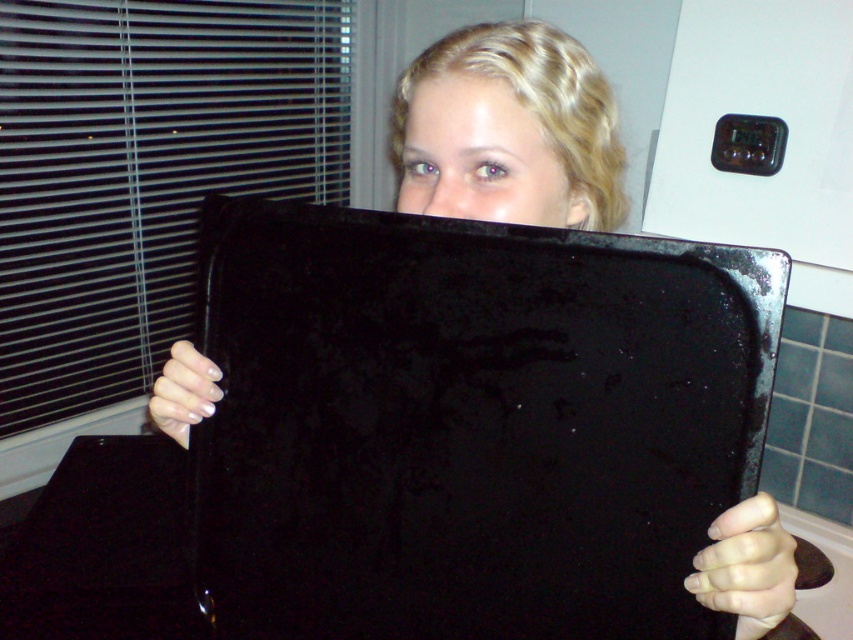
Who is more forward, [444,136] or [520,176]?

Point [520,176]

Image resolution: width=853 pixels, height=640 pixels. What do you see at coordinates (483, 156) in the screenshot?
I see `matte black tray at center` at bounding box center [483, 156].

Is point (567, 193) closer to viewer compared to point (454, 88)?

No, (567, 193) is behind (454, 88).

Identify the location of matte black tray at center. Image resolution: width=853 pixels, height=640 pixels. (483, 156).

Is black matte blind at left above matte black tray at center?

Yes, black matte blind at left is above matte black tray at center.

Can you confirm if black matte blind at left is thinner than matte black tray at center?

No.

Find the location of a particular element. This screenshot has width=853, height=640. black matte blind at left is located at coordinates (143, 172).

How distant is black matte blind at left from matte black face at upper center?

The distance of black matte blind at left from matte black face at upper center is 4.04 feet.

Which of these two, black matte blind at left or matte black face at upper center, stands taller?

black matte blind at left

I want to click on black matte blind at left, so click(x=143, y=172).